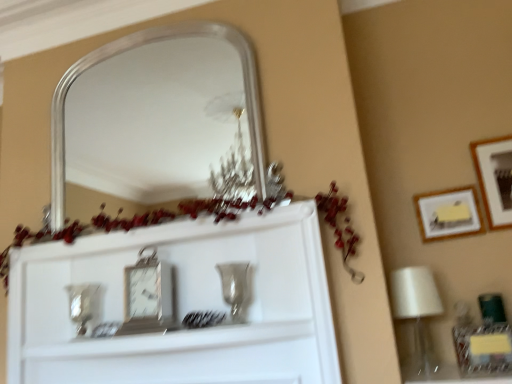
Question: Is matte yellow paper at upper right, the 2th picture frame when ordered from right to left, looking in the opposite direction of metallic rectangular clock at center?

Choices:
 (A) no
 (B) yes

Answer: (A)

Question: Can you confirm if matte yellow paper at upper right, which is the 1th picture frame in left-to-right order, is taller than metallic rectangular clock at center?

Choices:
 (A) no
 (B) yes

Answer: (A)

Question: Is matte yellow paper at upper right, which is the 1th picture frame in left-to-right order, positioned behind metallic rectangular clock at center?

Choices:
 (A) yes
 (B) no

Answer: (A)

Question: From a real-world perspective, is matte yellow paper at upper right, which is the 1th picture frame in left-to-right order, physically below metallic rectangular clock at center?

Choices:
 (A) yes
 (B) no

Answer: (B)

Question: Could you tell me if matte yellow paper at upper right, the 2th picture frame when ordered from right to left, is facing metallic rectangular clock at center?

Choices:
 (A) no
 (B) yes

Answer: (A)

Question: Considering the relative positions of matte yellow paper at upper right, the 2th picture frame when ordered from right to left, and metallic rectangular clock at center in the image provided, is matte yellow paper at upper right, the 2th picture frame when ordered from right to left, to the left of metallic rectangular clock at center from the viewer's perspective?

Choices:
 (A) yes
 (B) no

Answer: (B)

Question: Is metallic rectangular clock at center not near silver/metallic mirror at upper center?

Choices:
 (A) no
 (B) yes

Answer: (B)

Question: Does metallic rectangular clock at center have a greater height compared to silver/metallic mirror at upper center?

Choices:
 (A) yes
 (B) no

Answer: (B)

Question: From a real-world perspective, does metallic rectangular clock at center stand above silver/metallic mirror at upper center?

Choices:
 (A) no
 (B) yes

Answer: (A)

Question: Is metallic rectangular clock at center with silver/metallic mirror at upper center?

Choices:
 (A) yes
 (B) no

Answer: (B)

Question: Does metallic rectangular clock at center have a larger size compared to silver/metallic mirror at upper center?

Choices:
 (A) no
 (B) yes

Answer: (A)

Question: Is metallic rectangular clock at center facing away from silver/metallic mirror at upper center?

Choices:
 (A) no
 (B) yes

Answer: (A)

Question: Can you confirm if wooden framed picture at right, which is counted as the 1th picture frame, starting from the right, is thinner than metallic rectangular clock at center?

Choices:
 (A) no
 (B) yes

Answer: (B)